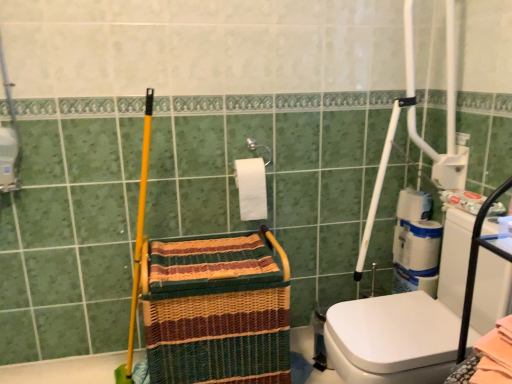
Question: Does white glossy washer at right have a greater height compared to woven straw basket at center?

Choices:
 (A) yes
 (B) no

Answer: (A)

Question: Considering the relative sizes of white glossy washer at right and woven straw basket at center in the image provided, is white glossy washer at right thinner than woven straw basket at center?

Choices:
 (A) no
 (B) yes

Answer: (A)

Question: Is white glossy washer at right shorter than woven straw basket at center?

Choices:
 (A) no
 (B) yes

Answer: (A)

Question: Considering the relative sizes of white glossy washer at right and woven straw basket at center in the image provided, is white glossy washer at right bigger than woven straw basket at center?

Choices:
 (A) no
 (B) yes

Answer: (B)

Question: Can you confirm if white glossy washer at right is positioned to the right of woven straw basket at center?

Choices:
 (A) yes
 (B) no

Answer: (A)

Question: From the image's perspective, would you say white glossy washer at right is positioned over woven straw basket at center?

Choices:
 (A) no
 (B) yes

Answer: (B)

Question: Does white matte toilet paper at right, placed as the 2th toilet paper when sorted from left to right, have a greater height compared to white glossy washer at right?

Choices:
 (A) no
 (B) yes

Answer: (A)

Question: From a real-world perspective, is white matte toilet paper at right, the 1th toilet paper viewed from the right, on top of white glossy washer at right?

Choices:
 (A) no
 (B) yes

Answer: (B)

Question: Is white matte toilet paper at right, which appears as the 2th toilet paper when viewed from the front, at the left side of white glossy washer at right?

Choices:
 (A) no
 (B) yes

Answer: (A)

Question: Does white matte toilet paper at right, which appears as the 2th toilet paper when viewed from the front, have a lesser height compared to white glossy washer at right?

Choices:
 (A) yes
 (B) no

Answer: (A)

Question: Considering the relative sizes of white matte toilet paper at right, which appears as the 2th toilet paper when viewed from the front, and white glossy washer at right in the image provided, is white matte toilet paper at right, which appears as the 2th toilet paper when viewed from the front, wider than white glossy washer at right?

Choices:
 (A) yes
 (B) no

Answer: (B)

Question: Are white matte toilet paper at right, which ranks as the 1th toilet paper in back-to-front order, and white glossy washer at right beside each other?

Choices:
 (A) yes
 (B) no

Answer: (B)

Question: Would you consider white matte toilet paper at right, which appears as the 2th toilet paper when viewed from the front, to be distant from woven straw basket at center?

Choices:
 (A) no
 (B) yes

Answer: (A)